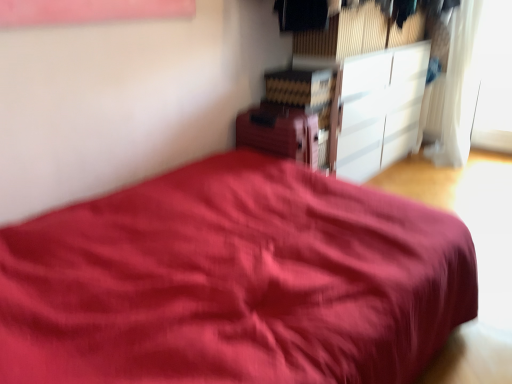
Question: Can you confirm if white glossy cabinet at upper right, the 2th cabinetry in the left-to-right sequence, is taller than transparent glass window at upper right?

Choices:
 (A) no
 (B) yes

Answer: (A)

Question: From a real-world perspective, is white glossy cabinet at upper right, which ranks as the 2th cabinetry in front-to-back order, beneath transparent glass window at upper right?

Choices:
 (A) no
 (B) yes

Answer: (B)

Question: Is white glossy cabinet at upper right, placed as the 1th cabinetry when sorted from right to left, thinner than transparent glass window at upper right?

Choices:
 (A) yes
 (B) no

Answer: (B)

Question: Is transparent glass window at upper right located within white glossy cabinet at upper right, which ranks as the 2th cabinetry in front-to-back order?

Choices:
 (A) yes
 (B) no

Answer: (B)

Question: Is white glossy cabinet at upper right, placed as the 1th cabinetry when sorted from right to left, wider than transparent glass window at upper right?

Choices:
 (A) no
 (B) yes

Answer: (B)

Question: In terms of height, does matte wooden cabinet at upper center, arranged as the 2th cabinetry when viewed from the back, look taller or shorter compared to transparent glass window at upper right?

Choices:
 (A) tall
 (B) short

Answer: (B)

Question: Considering the positions of matte wooden cabinet at upper center, positioned as the first cabinetry in front-to-back order, and transparent glass window at upper right in the image, is matte wooden cabinet at upper center, positioned as the first cabinetry in front-to-back order, bigger or smaller than transparent glass window at upper right?

Choices:
 (A) small
 (B) big

Answer: (B)

Question: Is matte wooden cabinet at upper center, arranged as the 2th cabinetry when viewed from the back, in front of or behind transparent glass window at upper right in the image?

Choices:
 (A) behind
 (B) front

Answer: (B)

Question: Considering the relative positions of matte wooden cabinet at upper center, the first cabinetry positioned from the left, and transparent glass window at upper right in the image provided, is matte wooden cabinet at upper center, the first cabinetry positioned from the left, to the left or to the right of transparent glass window at upper right?

Choices:
 (A) right
 (B) left

Answer: (B)

Question: Is transparent glass window at upper right wider or thinner than white glossy cabinet at upper right, the 2th cabinetry in the left-to-right sequence?

Choices:
 (A) wide
 (B) thin

Answer: (B)

Question: From a real-world perspective, is transparent glass window at upper right positioned above or below white glossy cabinet at upper right, which ranks as the 2th cabinetry in front-to-back order?

Choices:
 (A) above
 (B) below

Answer: (A)

Question: Relative to white glossy cabinet at upper right, which ranks as the 2th cabinetry in front-to-back order, is transparent glass window at upper right in front or behind?

Choices:
 (A) behind
 (B) front

Answer: (A)

Question: Considering the positions of transparent glass window at upper right and white glossy cabinet at upper right, which ranks as the 2th cabinetry in front-to-back order, in the image, is transparent glass window at upper right bigger or smaller than white glossy cabinet at upper right, which ranks as the 2th cabinetry in front-to-back order,?

Choices:
 (A) small
 (B) big

Answer: (A)

Question: Visually, is white sheer curtain at upper right positioned to the left or to the right of transparent glass window at upper right?

Choices:
 (A) right
 (B) left

Answer: (B)

Question: From the image's perspective, relative to transparent glass window at upper right, is white sheer curtain at upper right above or below?

Choices:
 (A) above
 (B) below

Answer: (B)